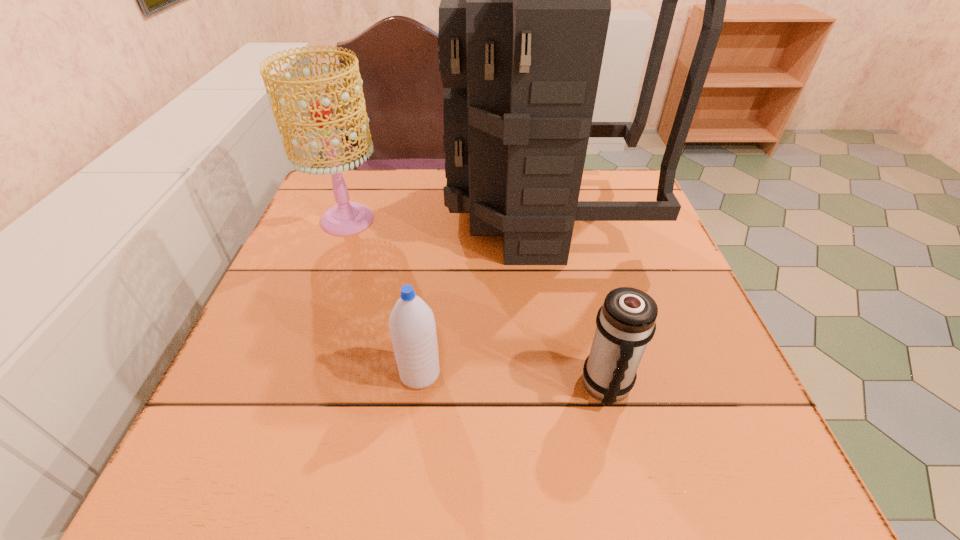
The height and width of the screenshot is (540, 960). I want to click on backpack, so click(525, 5).

I want to click on the leftmost object, so click(346, 218).

Where is `the second tallest object`? the second tallest object is located at coordinates (346, 218).

You are a GUI agent. You are given a task and a screenshot of the screen. Output one action in this format:
    pyautogui.click(x=<x>, y=<y>)
    Task: Click on the water bottle
    
    Given the screenshot: What is the action you would take?
    pyautogui.click(x=412, y=326)

Image resolution: width=960 pixels, height=540 pixels. Find the location of `thermos bottle`. thermos bottle is located at coordinates (626, 322).

You are a GUI agent. You are given a task and a screenshot of the screen. Output one action in this format:
    pyautogui.click(x=<x>, y=<y>)
    Task: Click on the vacant space positioned 0.250m on the front compartment of the backpack
    Image resolution: width=960 pixels, height=540 pixels.
    Given the screenshot: What is the action you would take?
    pyautogui.click(x=351, y=213)

You are a GUI agent. You are given a task and a screenshot of the screen. Output one action in this format:
    pyautogui.click(x=<x>, y=<y>)
    Task: Click on the free space located 0.170m on the front compartment of the backpack
    This screenshot has height=540, width=960.
    Given the screenshot: What is the action you would take?
    pyautogui.click(x=382, y=213)

You are a GUI agent. You are given a task and a screenshot of the screen. Output one action in this format:
    pyautogui.click(x=<x>, y=<y>)
    Task: Click on the vacant space located 0.060m on the front compartment of the backpack
    Image resolution: width=960 pixels, height=540 pixels.
    Given the screenshot: What is the action you would take?
    pyautogui.click(x=425, y=213)

This screenshot has height=540, width=960. What are the coordinates of `blank area located 0.120m on the right of the lampshade` in the screenshot? It's located at (433, 220).

Image resolution: width=960 pixels, height=540 pixels. I want to click on vacant space located on the left of the water bottle, so click(252, 374).